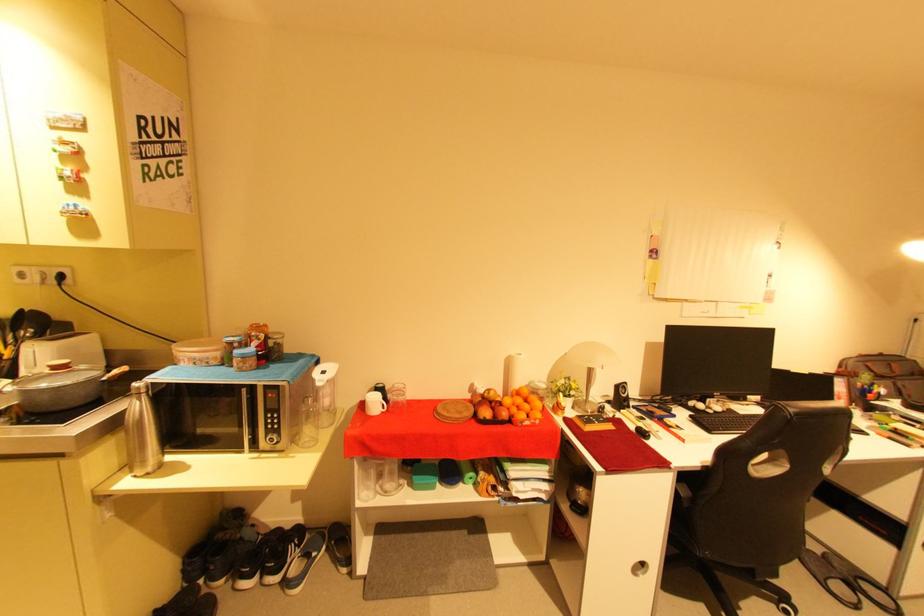
What do you see at coordinates (373, 403) in the screenshot?
I see `the white coffee mug` at bounding box center [373, 403].